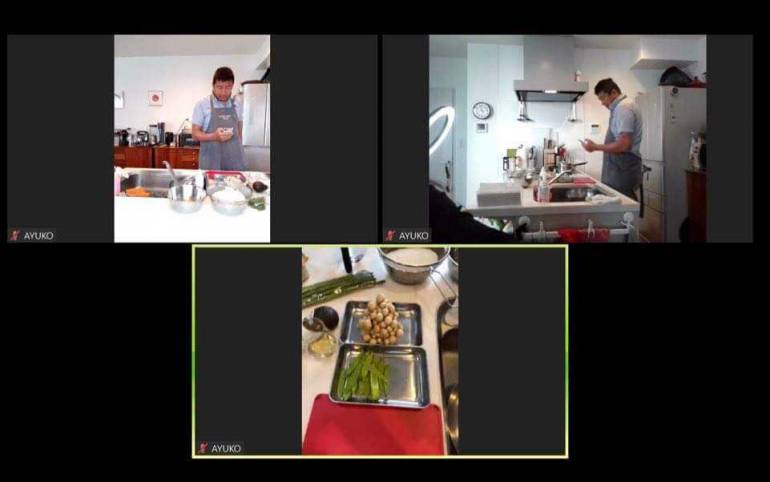
Locate an element on the screen. Image resolution: width=770 pixels, height=482 pixels. red tray is located at coordinates (356, 431), (219, 172), (583, 183).